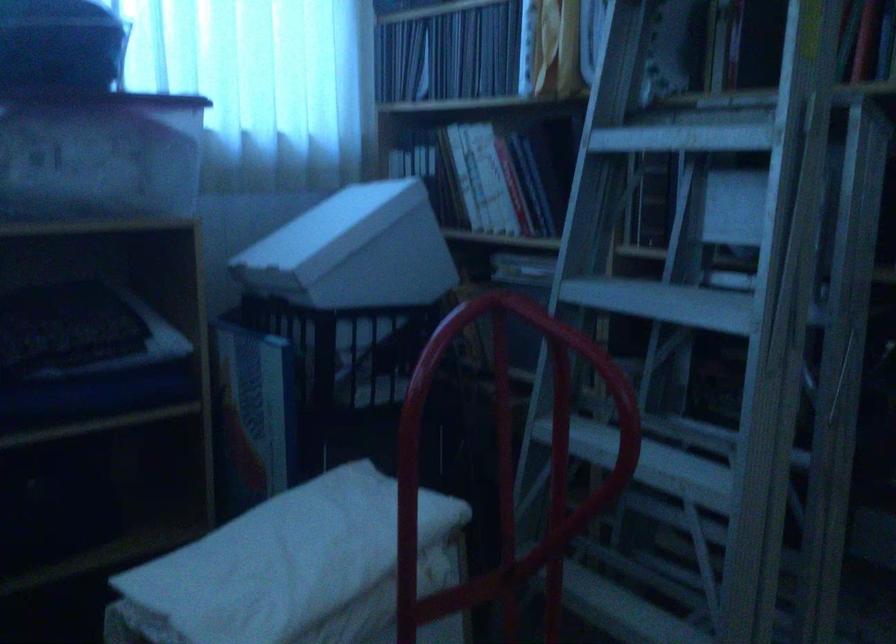
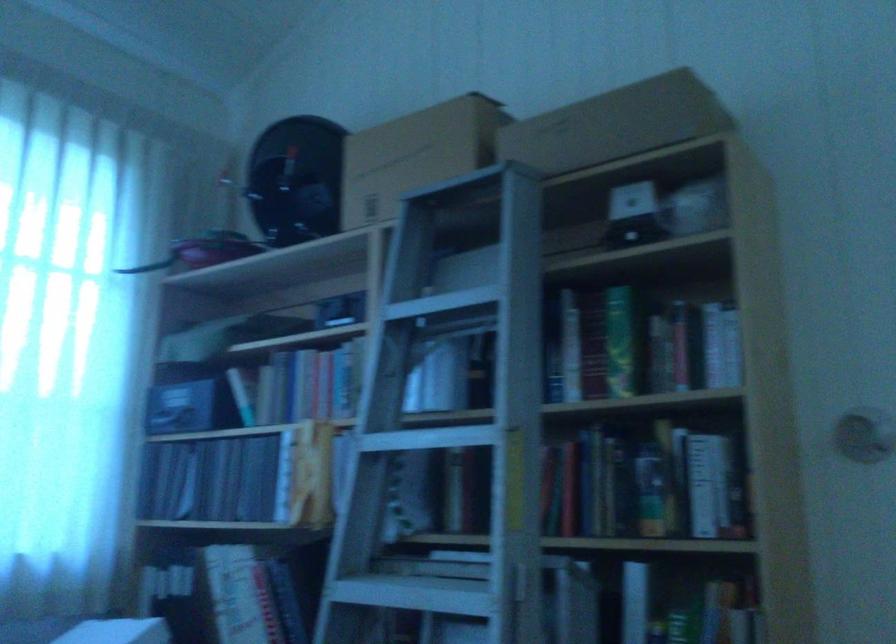
Question: How did the camera likely rotate?

Choices:
 (A) Left
 (B) Right
 (C) Up
 (D) Down

Answer: (C)